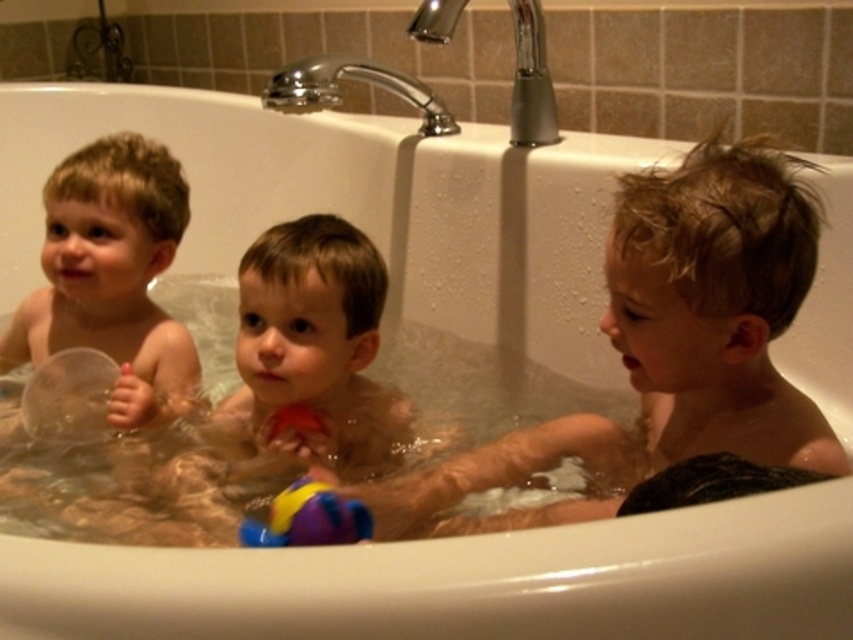
Question: Is blonde hair boy at center above rubberized multicolored ball at lower center?

Choices:
 (A) no
 (B) yes

Answer: (B)

Question: Does smooth plastic ball at center appear on the right side of transparent plastic cup at left?

Choices:
 (A) no
 (B) yes

Answer: (B)

Question: Which point is closer to the camera?

Choices:
 (A) rubberized multicolored ball at lower center
 (B) smooth plastic ball at center

Answer: (A)

Question: Considering the real-world distances, which object is closest to the rubberized multicolored ball at lower center?

Choices:
 (A) blonde hair boy at center
 (B) transparent plastic cup at left
 (C) smooth plastic ball at center

Answer: (C)

Question: Which object appears farthest from the camera in this image?

Choices:
 (A) transparent plastic cup at left
 (B) blonde hair boy at center

Answer: (A)

Question: Where is blonde hair boy at center located in relation to transparent plastic cup at left in the image?

Choices:
 (A) above
 (B) below

Answer: (B)